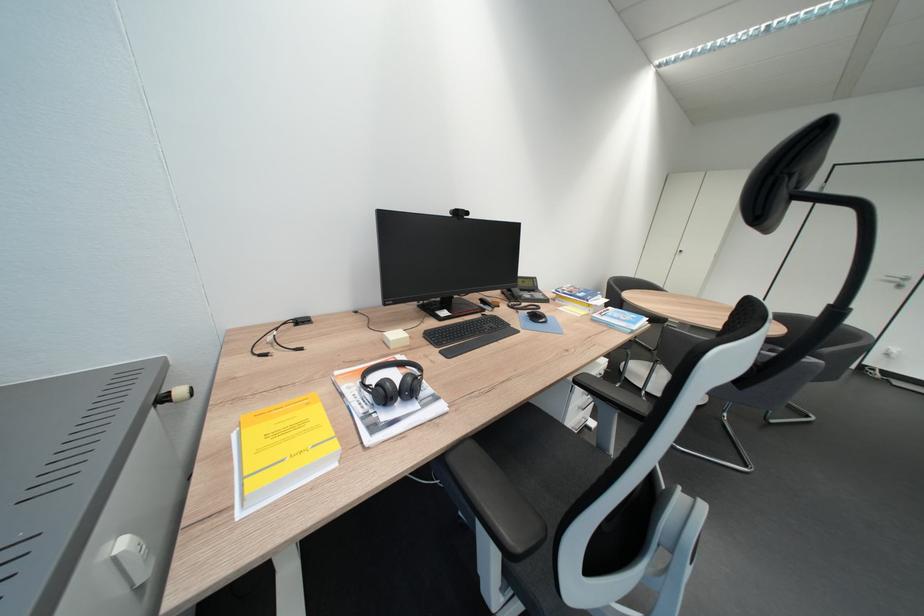
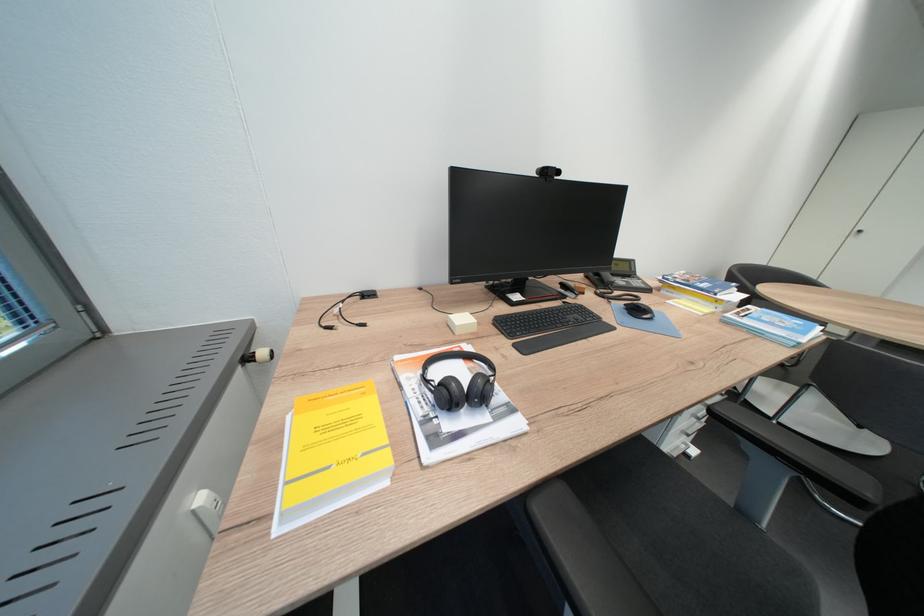
In the second image, find the point that corresponds to the point at 287,436 in the first image.

(338, 430)